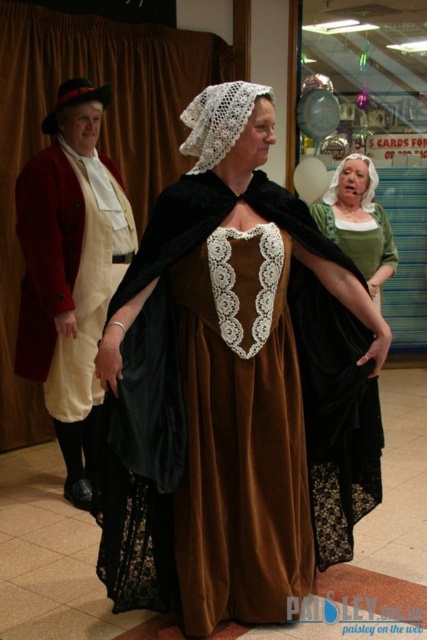
Does brown velvet dress at center have a greater width compared to velvet green dress at center?

Correct, the width of brown velvet dress at center exceeds that of velvet green dress at center.

Is point (158, 560) more distant than point (348, 480)?

No, (158, 560) is in front of (348, 480).

This screenshot has height=640, width=427. Identify the location of brown velvet dress at center. (234, 388).

Which is above, brown velvet dress at center or matte white coat at left?

matte white coat at left is above.

Is brown velvet dress at center further to the viewer compared to matte white coat at left?

No, brown velvet dress at center is in front of matte white coat at left.

Is point (204, 451) positioned in front of point (96, 339)?

Yes, it is in front of point (96, 339).

This screenshot has width=427, height=640. What are the coordinates of `brown velvet dress at center` in the screenshot? It's located at (234, 388).

Consider the image. Does matte white coat at left appear over velvet green dress at center?

No.

Can you confirm if matte white coat at left is positioned to the left of velvet green dress at center?

Result: Yes, matte white coat at left is to the left of velvet green dress at center.

The height and width of the screenshot is (640, 427). What are the coordinates of `matte white coat at left` in the screenshot? It's located at (70, 269).

The height and width of the screenshot is (640, 427). I want to click on matte white coat at left, so click(x=70, y=269).